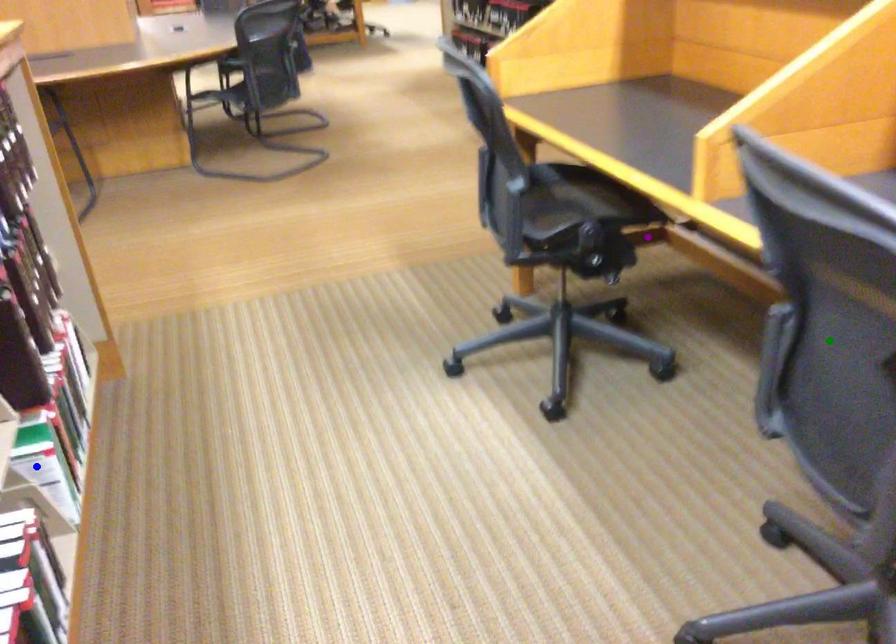
Order these from nearest to farthest:
- green point
- purple point
- blue point

green point → blue point → purple point